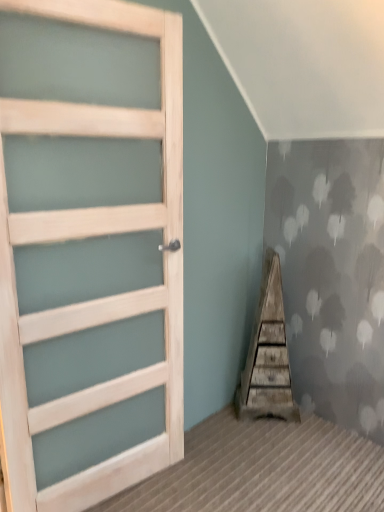
Question: From a real-world perspective, is weathered wood stairwell at center positioned above or below light wood door at left?

Choices:
 (A) above
 (B) below

Answer: (B)

Question: Is weathered wood stairwell at center bigger or smaller than light wood door at left?

Choices:
 (A) big
 (B) small

Answer: (B)

Question: From the image's perspective, is weathered wood stairwell at center above or below light wood door at left?

Choices:
 (A) below
 (B) above

Answer: (A)

Question: In terms of height, does light wood door at left look taller or shorter compared to weathered wood stairwell at center?

Choices:
 (A) short
 (B) tall

Answer: (B)

Question: Considering the positions of light wood door at left and weathered wood stairwell at center in the image, is light wood door at left wider or thinner than weathered wood stairwell at center?

Choices:
 (A) thin
 (B) wide

Answer: (A)

Question: Looking at the image, does light wood door at left seem bigger or smaller compared to weathered wood stairwell at center?

Choices:
 (A) small
 (B) big

Answer: (B)

Question: From a real-world perspective, is light wood door at left above or below weathered wood stairwell at center?

Choices:
 (A) below
 (B) above

Answer: (B)